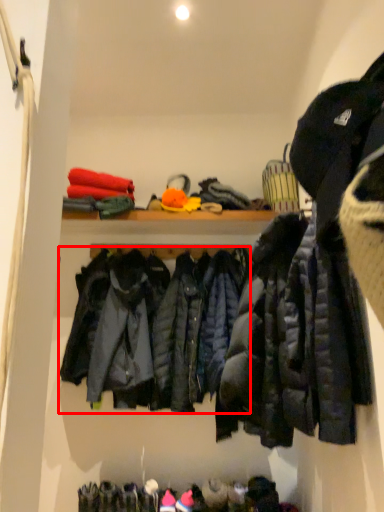
Question: From the image's perspective, where is jacket (annotated by the red box) located in relation to jacket in the image?

Choices:
 (A) below
 (B) above

Answer: (A)